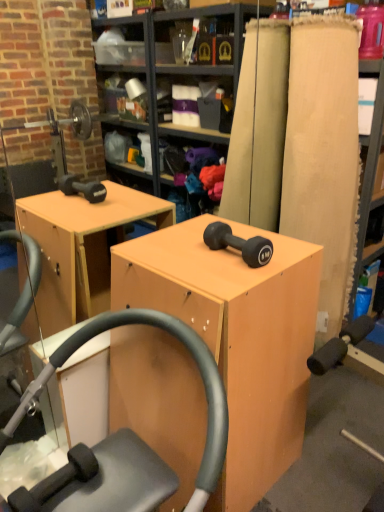
The height and width of the screenshot is (512, 384). I want to click on free point above matte wood cabinet at center (from a real-world perspective), so click(x=196, y=258).